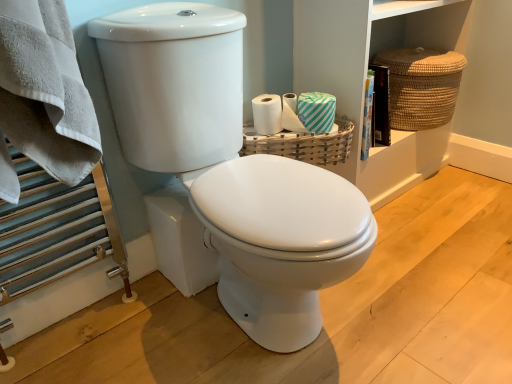
Find the location of a particular element. This screenshot has height=384, width=512. vacant area to the right of white glossy toilet at center, positioned as the first toilet in front-to-back order is located at coordinates (425, 283).